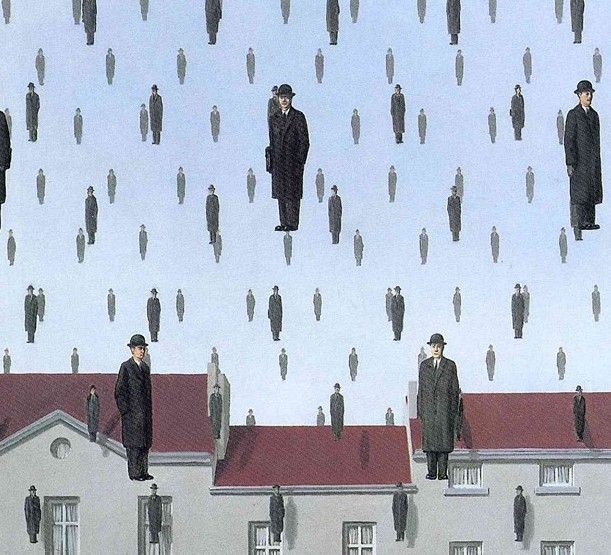
The image size is (611, 555). I want to click on windows, so point(63,512), point(148,541), point(60,446), point(262,543), point(356,539), point(467,471), point(466,548), point(557,544), point(555,470).